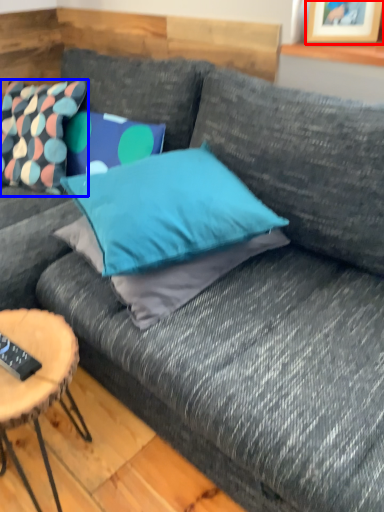
Question: Which of the following is the closest to the observer, picture frame (highlighted by a red box) or pillow (highlighted by a blue box)?

Choices:
 (A) picture frame
 (B) pillow

Answer: (A)